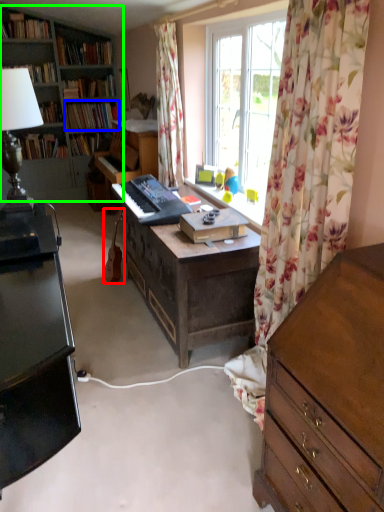
Question: Which is farther away from instrument (highlighted by a red box)? book (highlighted by a blue box) or bookcase (highlighted by a green box)?

Choices:
 (A) book
 (B) bookcase

Answer: (A)